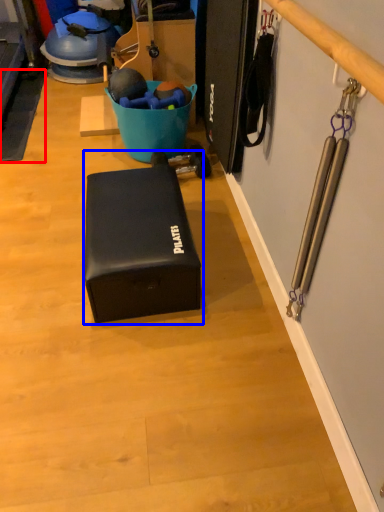
Question: Which of the following is the closest to the observer, yoga mat (highlighted by a red box) or box (highlighted by a blue box)?

Choices:
 (A) yoga mat
 (B) box

Answer: (B)